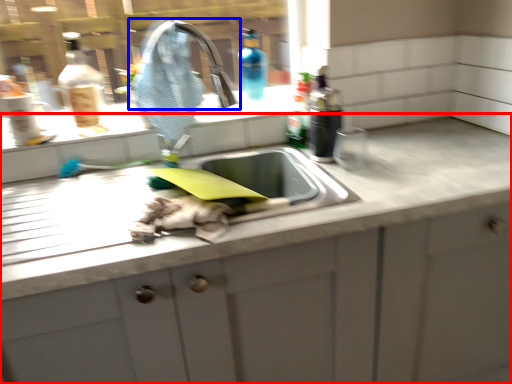
Question: Among these objects, which one is farthest to the camera, countertop (highlighted by a red box) or tap (highlighted by a blue box)?

Choices:
 (A) countertop
 (B) tap

Answer: (B)